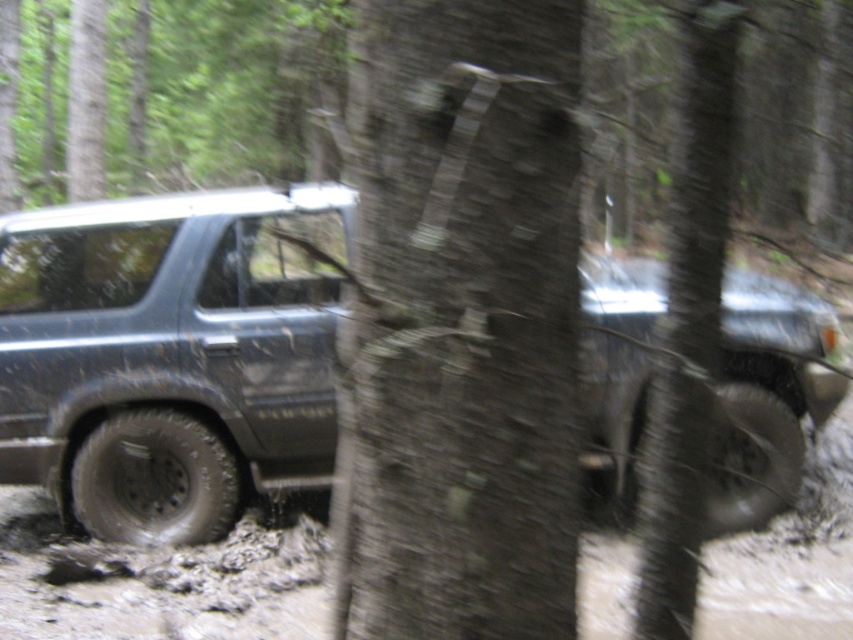
Between point (55, 346) and point (648, 538), which one is positioned behind?

The point (55, 346) is more distant.

The image size is (853, 640). What do you see at coordinates (169, 355) in the screenshot?
I see `muddy rubber jeep at center` at bounding box center [169, 355].

Where is `muddy rubber jeep at center`? The width and height of the screenshot is (853, 640). muddy rubber jeep at center is located at coordinates (169, 355).

Can you confirm if muddy rubber jeep at center is positioned to the right of muddy rubber tire at lower left?

Indeed, muddy rubber jeep at center is positioned on the right side of muddy rubber tire at lower left.

Between point (94, 368) and point (78, 496), which one is positioned behind?

Point (78, 496)

This screenshot has width=853, height=640. I want to click on muddy rubber jeep at center, so click(169, 355).

Can you confirm if muddy rubber tire at lower left is bigger than muddy rubber tire at lower right?

Incorrect, muddy rubber tire at lower left is not larger than muddy rubber tire at lower right.

Which is behind, point (222, 460) or point (738, 477)?

Positioned behind is point (738, 477).

Find the location of `muddy rubber tire at lower left`. muddy rubber tire at lower left is located at coordinates (155, 480).

Where is `muddy rubber tire at lower left`? This screenshot has width=853, height=640. muddy rubber tire at lower left is located at coordinates (155, 480).